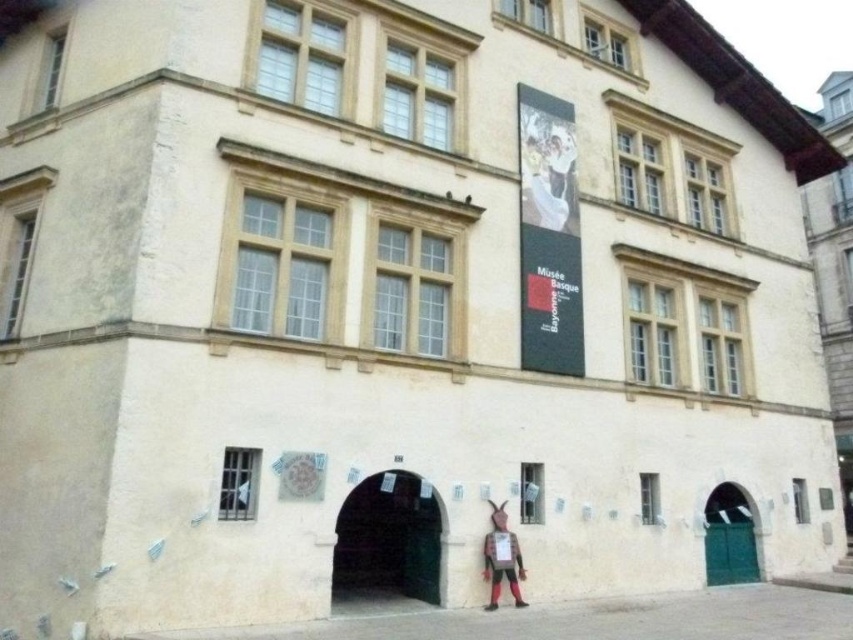
Is matte white dress at upper center positioned at the back of matte brown figure at lower center?

Yes, it is behind matte brown figure at lower center.

Which is in front, point (538, 152) or point (503, 504)?

Point (503, 504) is in front.

In order to click on matte white dress at upper center in this screenshot , I will do `click(548, 168)`.